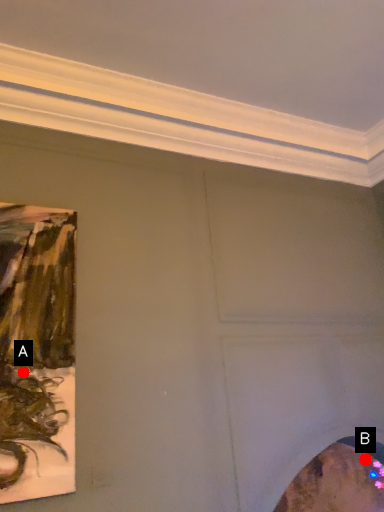
Question: Two points are circled on the image, labeled by A and B beside each circle. Which point is closer to the camera?

Choices:
 (A) A is closer
 (B) B is closer

Answer: (A)